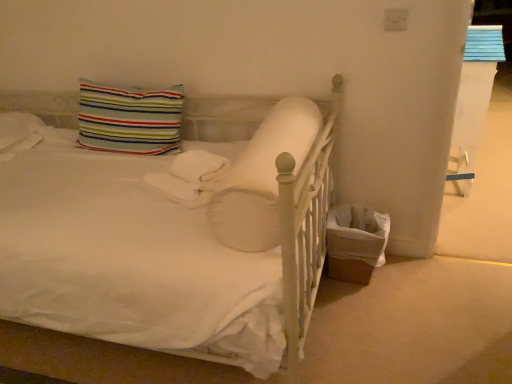
Question: Relative to white soft pillow at center, the 1th pillow viewed from the right, is striped fabric pillow at upper left, the second pillow in the right-to-left sequence, in front or behind?

Choices:
 (A) front
 (B) behind

Answer: (B)

Question: From a real-world perspective, relative to white soft pillow at center, marked as the first pillow in a front-to-back arrangement, is striped fabric pillow at upper left, marked as the 2th pillow in a front-to-back arrangement, vertically above or below?

Choices:
 (A) below
 (B) above

Answer: (B)

Question: In terms of width, does striped fabric pillow at upper left, the second pillow in the right-to-left sequence, look wider or thinner when compared to white soft pillow at center, placed as the 2th pillow when sorted from back to front?

Choices:
 (A) thin
 (B) wide

Answer: (A)

Question: Considering the relative positions of white soft pillow at center, which is the 2th pillow from left to right, and striped fabric pillow at upper left, the second pillow in the right-to-left sequence, in the image provided, is white soft pillow at center, which is the 2th pillow from left to right, to the left or to the right of striped fabric pillow at upper left, the second pillow in the right-to-left sequence,?

Choices:
 (A) right
 (B) left

Answer: (A)

Question: From the image's perspective, relative to striped fabric pillow at upper left, the second pillow in the right-to-left sequence, is white soft pillow at center, which is the 2th pillow from left to right, above or below?

Choices:
 (A) above
 (B) below

Answer: (B)

Question: From a real-world perspective, is white soft pillow at center, the 1th pillow viewed from the right, positioned above or below striped fabric pillow at upper left, marked as the 2th pillow in a front-to-back arrangement?

Choices:
 (A) above
 (B) below

Answer: (B)

Question: Looking at their shapes, would you say white soft pillow at center, placed as the 2th pillow when sorted from back to front, is wider or thinner than striped fabric pillow at upper left, which is the first pillow in left-to-right order?

Choices:
 (A) wide
 (B) thin

Answer: (A)